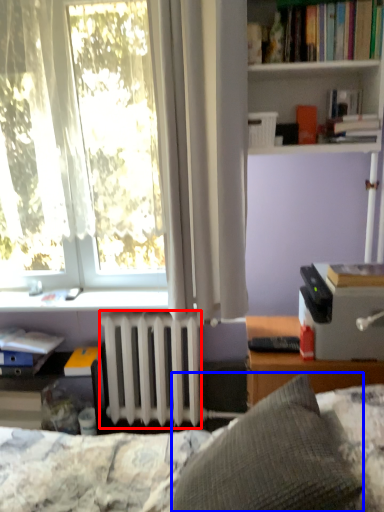
Question: Which of the following is the farthest to the observer, radiator (highlighted by a red box) or pillow (highlighted by a blue box)?

Choices:
 (A) radiator
 (B) pillow

Answer: (A)